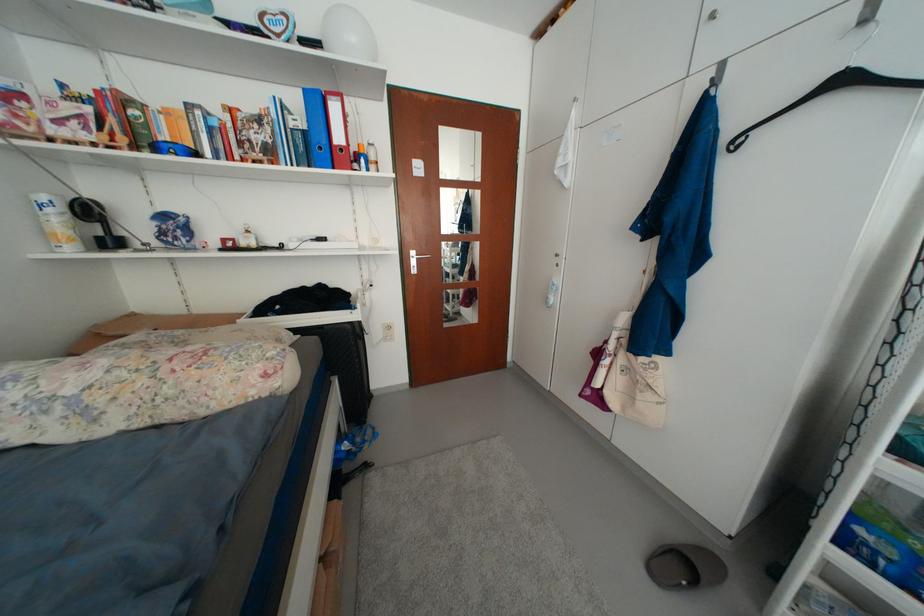
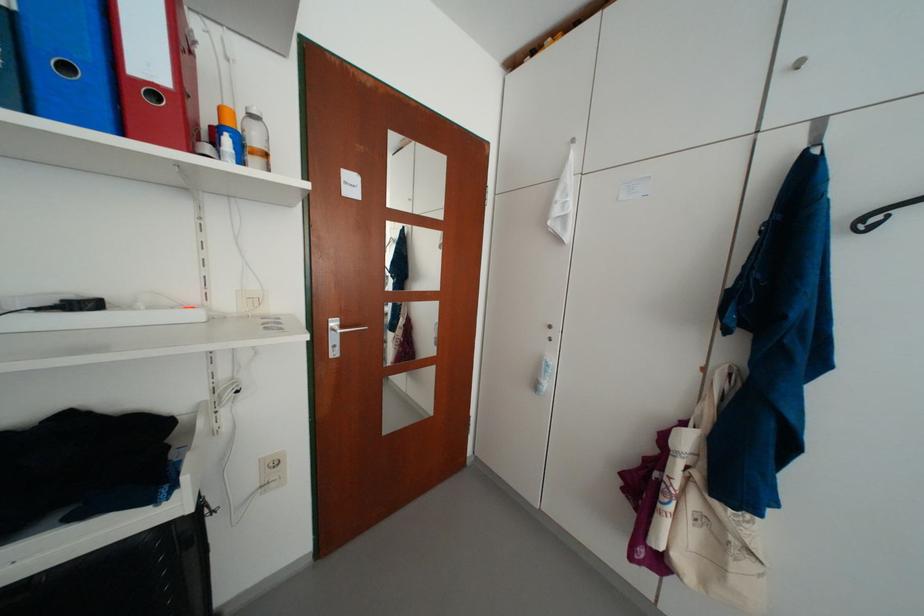
Find the pixel in the second image that matches [330,151] in the first image.

(76, 70)